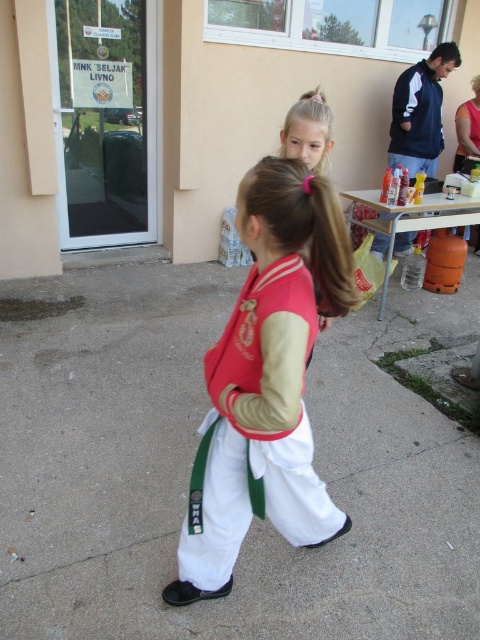
Between point (478, 618) and point (320, 513), which one is positioned behind?

The point (478, 618) is more distant.

Locate an element on the screen. This screenshot has width=480, height=640. white concrete pavement at center is located at coordinates click(x=191, y=465).

Identify the location of white concrete pavement at center. This screenshot has height=640, width=480. (191, 465).